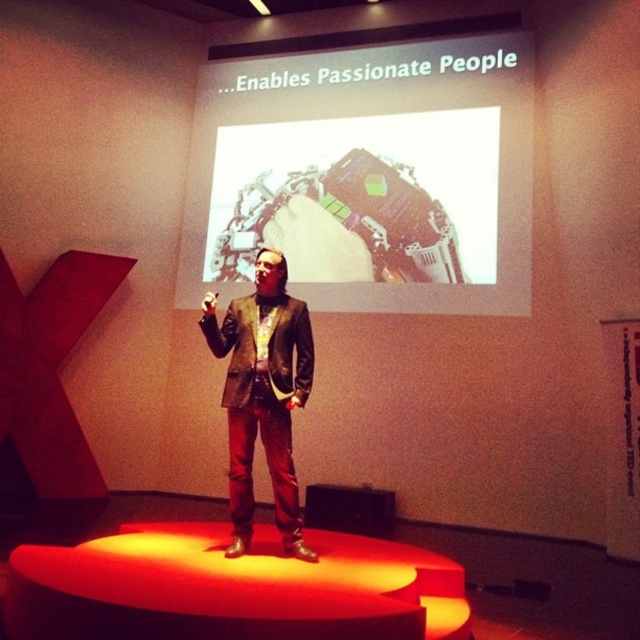
Question: Does white matte projection screen at upper center appear over brown leather jacket at center?

Choices:
 (A) no
 (B) yes

Answer: (B)

Question: Which object appears closest to the camera in this image?

Choices:
 (A) white matte projection screen at upper center
 (B) brown leather jacket at center

Answer: (B)

Question: Which object appears closest to the camera in this image?

Choices:
 (A) white matte projection screen at upper center
 (B) brown leather jacket at center

Answer: (B)

Question: Is white matte projection screen at upper center in front of brown leather jacket at center?

Choices:
 (A) yes
 (B) no

Answer: (B)

Question: Does white matte projection screen at upper center appear on the right side of brown leather jacket at center?

Choices:
 (A) yes
 (B) no

Answer: (A)